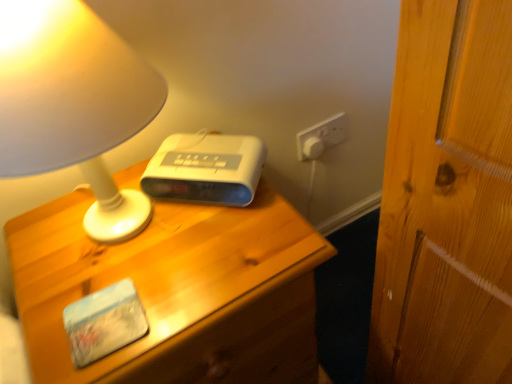
This screenshot has width=512, height=384. Find the location of `vacant space situated on the left part of white plastic alarm clock at center`. vacant space situated on the left part of white plastic alarm clock at center is located at coordinates (97, 218).